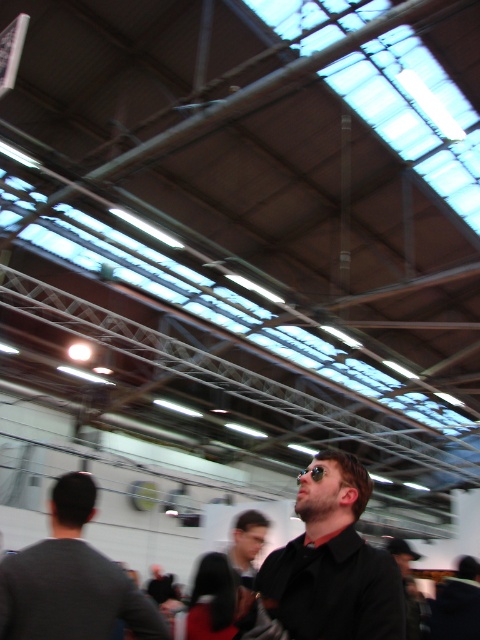
Is black matte shirt at center above sunglasses at center?

Yes, black matte shirt at center is above sunglasses at center.

Between point (319, 456) and point (308, 472), which one is positioned in front?

Point (308, 472) is more forward.

Locate an element on the screen. Image resolution: width=480 pixels, height=640 pixels. black matte shirt at center is located at coordinates (333, 563).

Is black matte shirt at center smaller than dark brown leather jacket at center?

No, black matte shirt at center is not smaller than dark brown leather jacket at center.

Is black matte shirt at center wider than dark brown leather jacket at center?

Yes, black matte shirt at center is wider than dark brown leather jacket at center.

Locate an element on the screen. black matte shirt at center is located at coordinates (333, 563).

Does gray fabric shirt at left lie in front of dark brown leather jacket at center?

Yes.

Which is below, gray fabric shirt at left or dark brown leather jacket at center?

Positioned lower is dark brown leather jacket at center.

Is point (139, 618) positioned after point (250, 529)?

That is False.

The width and height of the screenshot is (480, 640). What are the coordinates of `gray fabric shirt at left` in the screenshot? It's located at (71, 580).